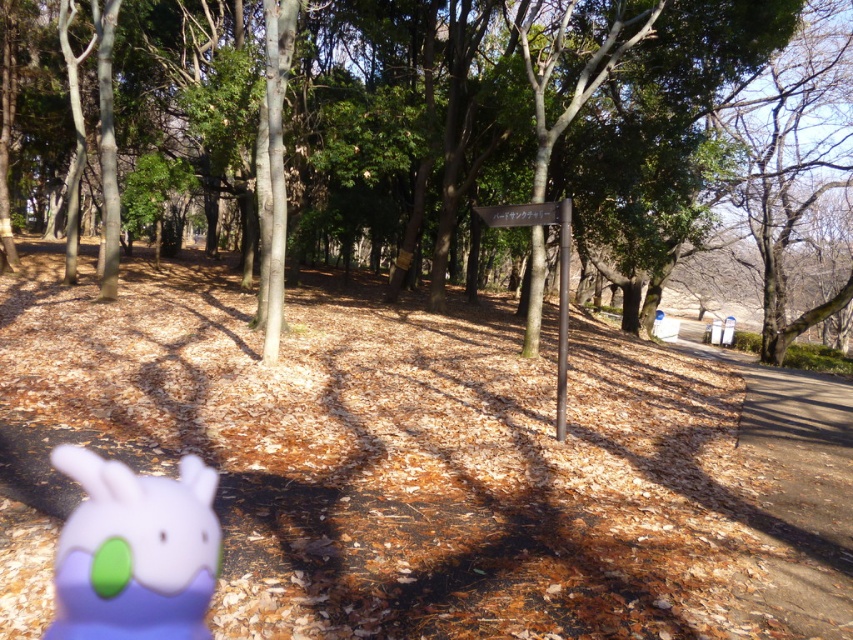
Between point (224, 124) and point (202, 465), which one is positioned in front?

Point (202, 465)

Describe the element at coordinates (524, 115) in the screenshot. I see `green leafy tree at center` at that location.

At what (x,y) coordinates should I click in order to perform the action: click on green leafy tree at center. Please return your answer as a coordinate pair (x, y). This screenshot has width=853, height=640. Looking at the image, I should click on (524, 115).

Is brown dry leaves at center wider than green leafy tree at center?

No.

Looking at this image, can you confirm if brown dry leaves at center is thinner than green leafy tree at center?

Indeed, brown dry leaves at center has a lesser width compared to green leafy tree at center.

Where is `brown dry leaves at center`? brown dry leaves at center is located at coordinates (421, 460).

Where is `brown dry leaves at center`? brown dry leaves at center is located at coordinates (421, 460).

Is brown dry leaves at center smaller than black wood sign at center?

No.

You are a GUI agent. You are given a task and a screenshot of the screen. Output one action in this format:
    pyautogui.click(x=<x>, y=<y>)
    Task: Click on the brown dry leaves at center
    Image resolution: width=853 pixels, height=640 pixels.
    Given the screenshot: What is the action you would take?
    pyautogui.click(x=421, y=460)